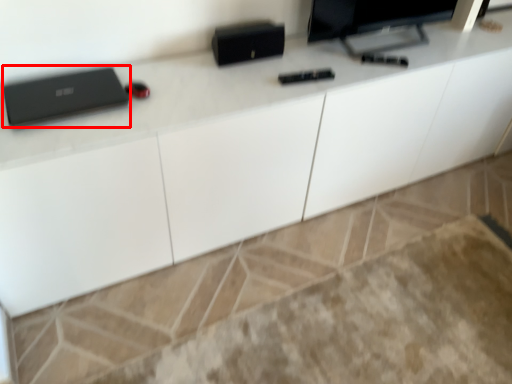
Question: From the image's perspective, what is the correct spatial relationship of laptop (annotated by the red box) in relation to computer monitor?

Choices:
 (A) above
 (B) below

Answer: (B)